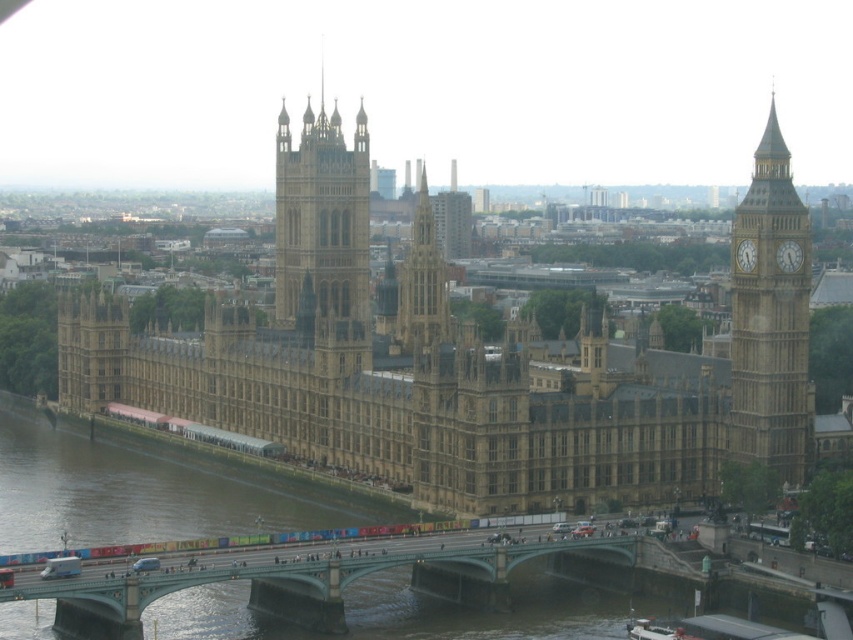
You are a tourist standing on the bridge and want to take a photo of both the golden stone tower at center and the gold metallic clock at right. Which object should you frame first in your camera to ensure both are visible in the photo?

You should frame the golden stone tower at center first because it is wider than the gold metallic clock at right, so capturing its width will help include the smaller clock in the same shot.

You are a tourist standing on the bridge and looking at the golden stone tower at center and the golden stone spire at center. Which one do you see higher in the sky?

The golden stone tower at center is taller than the golden stone spire at center, so you see the golden stone tower at center higher in the sky.